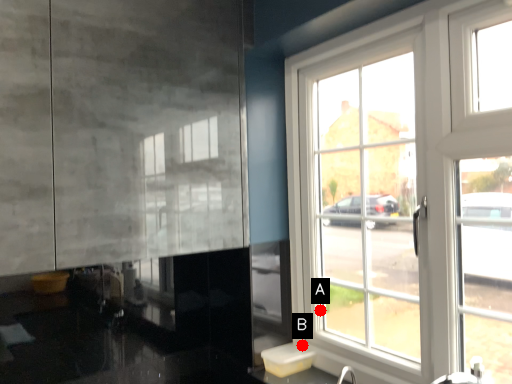
Question: Two points are circled on the image, labeled by A and B beside each circle. Which point appears closest to the camera in this image?

Choices:
 (A) A is closer
 (B) B is closer

Answer: (B)